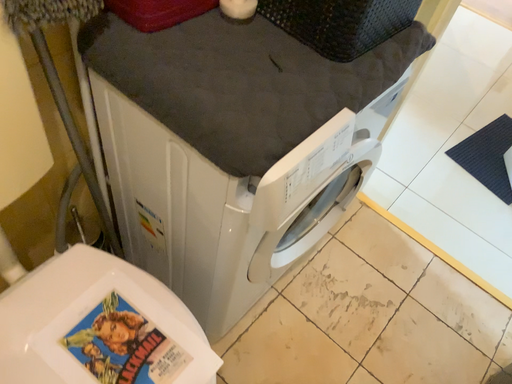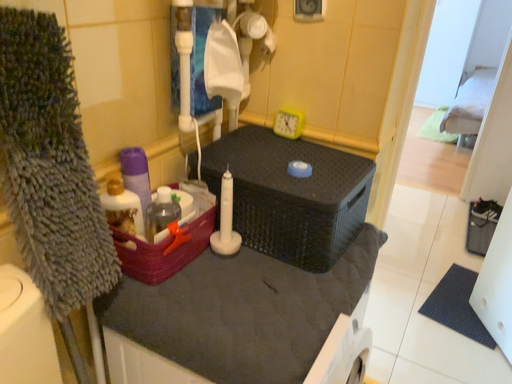
Question: Which way did the camera rotate in the video?

Choices:
 (A) rotated upward
 (B) rotated downward

Answer: (A)